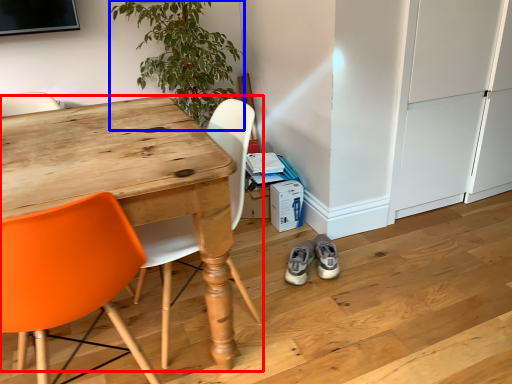
Question: Which point is closer to the camera, desk (highlighted by a red box) or houseplant (highlighted by a blue box)?

Choices:
 (A) desk
 (B) houseplant

Answer: (A)